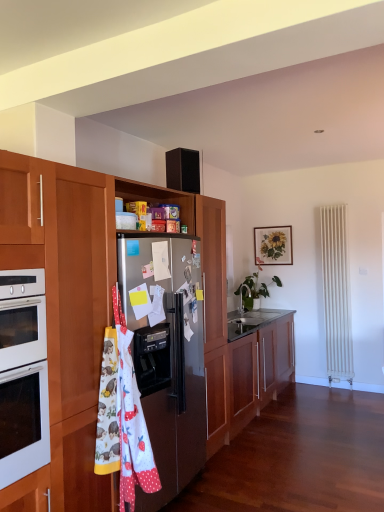
Question: Considering the relative sizes of wooden cabinet at center, the 2th cabinetry viewed from the top, and wooden picture frame at upper center in the image provided, is wooden cabinet at center, the 2th cabinetry viewed from the top, thinner than wooden picture frame at upper center?

Choices:
 (A) yes
 (B) no

Answer: (B)

Question: Is wooden cabinet at center, which is the first cabinetry from bottom to top, far away from wooden picture frame at upper center?

Choices:
 (A) yes
 (B) no

Answer: (A)

Question: Considering the relative sizes of wooden cabinet at center, which is the first cabinetry from bottom to top, and wooden picture frame at upper center in the image provided, is wooden cabinet at center, which is the first cabinetry from bottom to top, wider than wooden picture frame at upper center?

Choices:
 (A) no
 (B) yes

Answer: (B)

Question: Is wooden cabinet at center, the 2th cabinetry viewed from the top, in contact with wooden picture frame at upper center?

Choices:
 (A) no
 (B) yes

Answer: (A)

Question: From the image's perspective, is wooden cabinet at center, which is the first cabinetry from bottom to top, located beneath wooden picture frame at upper center?

Choices:
 (A) no
 (B) yes

Answer: (B)

Question: Can you confirm if wooden cabinet at center, the 2th cabinetry viewed from the top, is shorter than wooden picture frame at upper center?

Choices:
 (A) no
 (B) yes

Answer: (A)

Question: Is satin metallic refrigerator at center-left to the right of wooden cabinet at center, which is the first cabinetry from bottom to top, from the viewer's perspective?

Choices:
 (A) yes
 (B) no

Answer: (B)

Question: Considering the relative sizes of satin metallic refrigerator at center-left and wooden cabinet at center, which is the first cabinetry from bottom to top, in the image provided, is satin metallic refrigerator at center-left smaller than wooden cabinet at center, which is the first cabinetry from bottom to top,?

Choices:
 (A) yes
 (B) no

Answer: (A)

Question: From the image's perspective, would you say satin metallic refrigerator at center-left is positioned over wooden cabinet at center, which is the first cabinetry from bottom to top?

Choices:
 (A) yes
 (B) no

Answer: (A)

Question: From the image's perspective, is satin metallic refrigerator at center-left beneath wooden cabinet at center, the 2th cabinetry viewed from the top?

Choices:
 (A) yes
 (B) no

Answer: (B)

Question: Does satin metallic refrigerator at center-left appear on the left side of wooden cabinet at center, the 2th cabinetry viewed from the top?

Choices:
 (A) no
 (B) yes

Answer: (B)

Question: Is satin metallic refrigerator at center-left positioned behind wooden cabinet at center, the 2th cabinetry viewed from the top?

Choices:
 (A) yes
 (B) no

Answer: (B)

Question: Considering the relative sizes of green glossy plant at center and wooden cabinet at center, marked as the 2th cabinetry in a bottom-to-top arrangement, in the image provided, is green glossy plant at center shorter than wooden cabinet at center, marked as the 2th cabinetry in a bottom-to-top arrangement,?

Choices:
 (A) yes
 (B) no

Answer: (A)